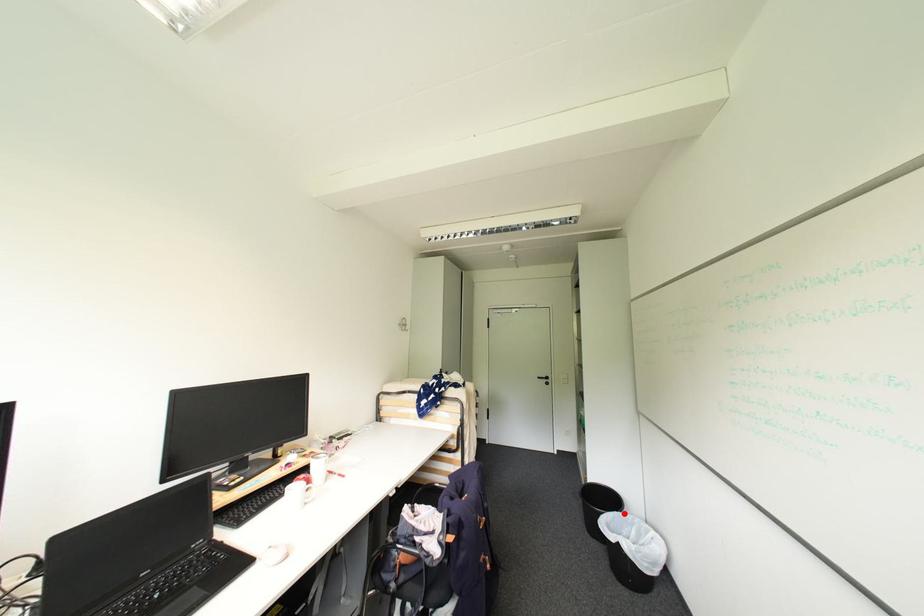
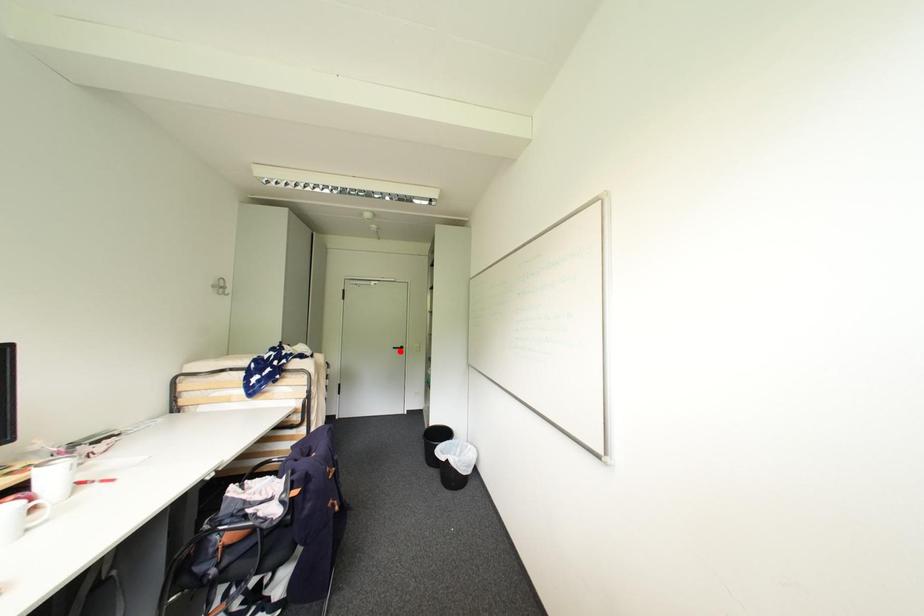
Consider the image. I am providing you with two images of the same scene from different viewpoints. A red point is marked on the first image and another point is marked on the second image. Is the red point in image1 aligned with the point shown in image2?

No